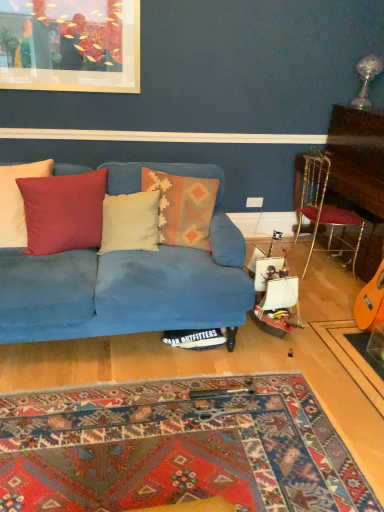
Find the location of a particular element. This screenshot has width=384, height=512. vacant area on top of carpet with intricate patterns at lower center (from a real-world perspective) is located at coordinates 150,444.